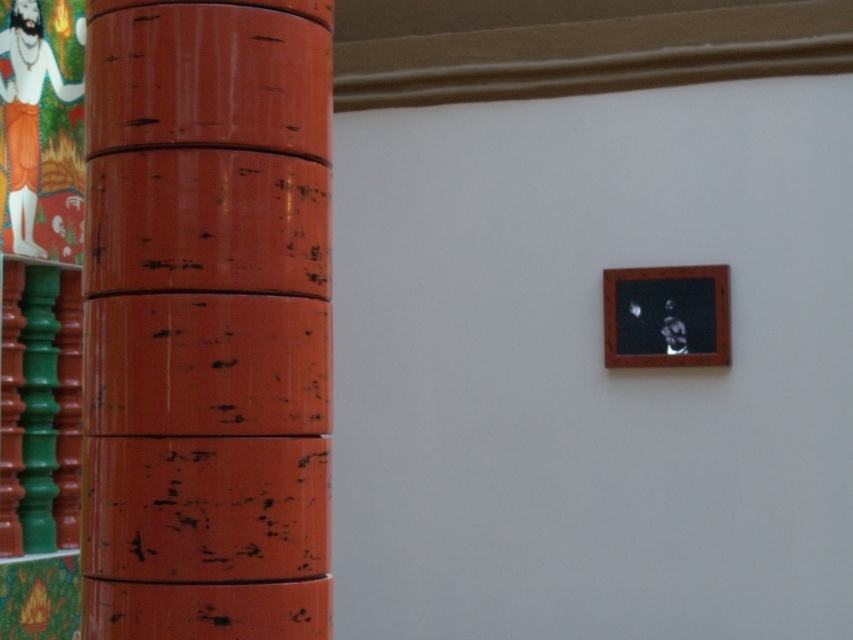
From the picture: You are an interior designer planning to hang a new artwork. You have two options to place them in the space shown. The first option is to place the artwork next to the scratched orange pillar at left, and the second is to place it above the wooden frame at upper right. Considering the size of the objects, which placement would require a larger artwork to maintain proportion?

The scratched orange pillar at left is larger in size than the wooden frame at upper right. Therefore, placing the artwork next to the scratched orange pillar at left would require a larger artwork to maintain proportion.

You are an interior designer planning to hang a new artwork. You see the scratched orange pillar at left and the wooden frame at upper right. Which object is positioned closer to the left side of the room?

The scratched orange pillar at left is positioned closer to the left side of the room than the wooden frame at upper right.

You are an interior designer planning to hang a new artwork on the wall. You have two options to choose from. One is a large abstract painting that requires a sturdy support due to its weight, and the other is a lightweight sculpture that can be placed on the floor. Considering the scratched orange pillar at left and the wooden frame at upper right in the scene, which artwork would be more appropriate for each location and why?

The large abstract painting requiring sturdy support should be hung near the wooden frame at upper right because it is an upper location and the pillar below might not provide enough support for heavy items. The lightweight sculpture can be placed near the scratched orange pillar at left since it is a stable, lower structure suitable for floor items.